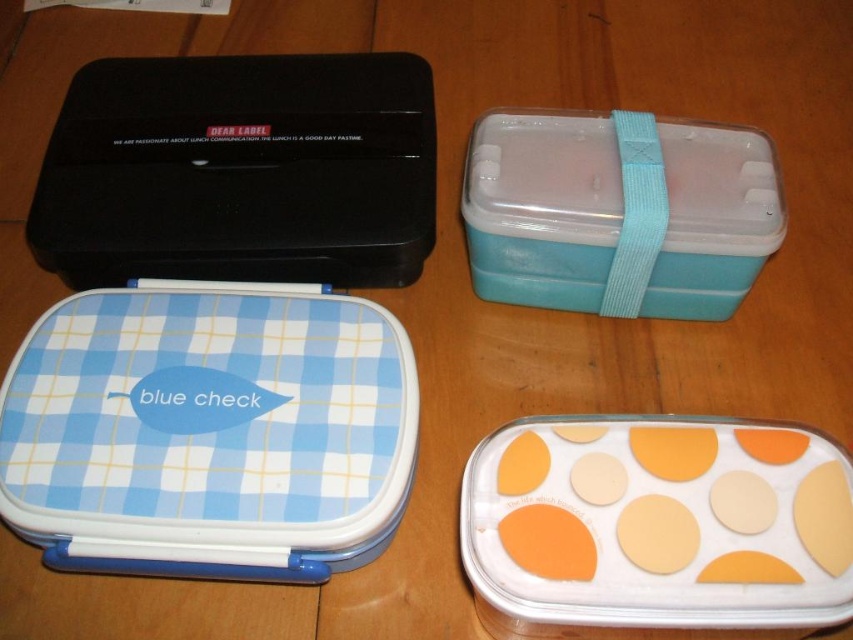
You are organizing lunchboxes on a shelf and need to place the black plastic lunch box at upper left and the teal plastic lunchbox at upper right in a row from left to right. Based on their positions in the image, which lunchbox should you place first on the left side of the shelf?

The black plastic lunch box at upper left should be placed first on the left side of the shelf because it is positioned to the left of the teal plastic lunchbox at upper right in the image.

Which lunchbox is positioned at the coordinates point (209, 433)?

The blue checkered lunchbox at center is positioned at point (209, 433).